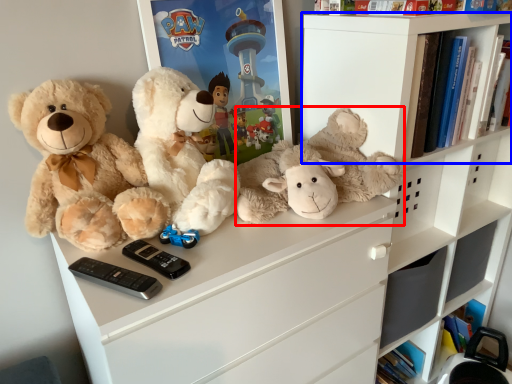
Question: Among these objects, which one is nearest to the camera, teddy bear (highlighted by a red box) or shelf (highlighted by a blue box)?

Choices:
 (A) teddy bear
 (B) shelf

Answer: (A)